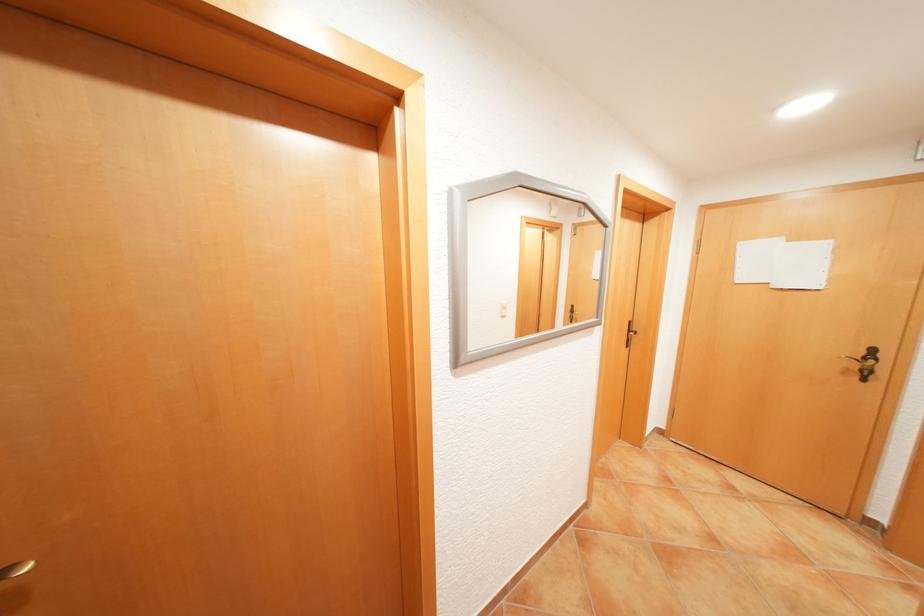
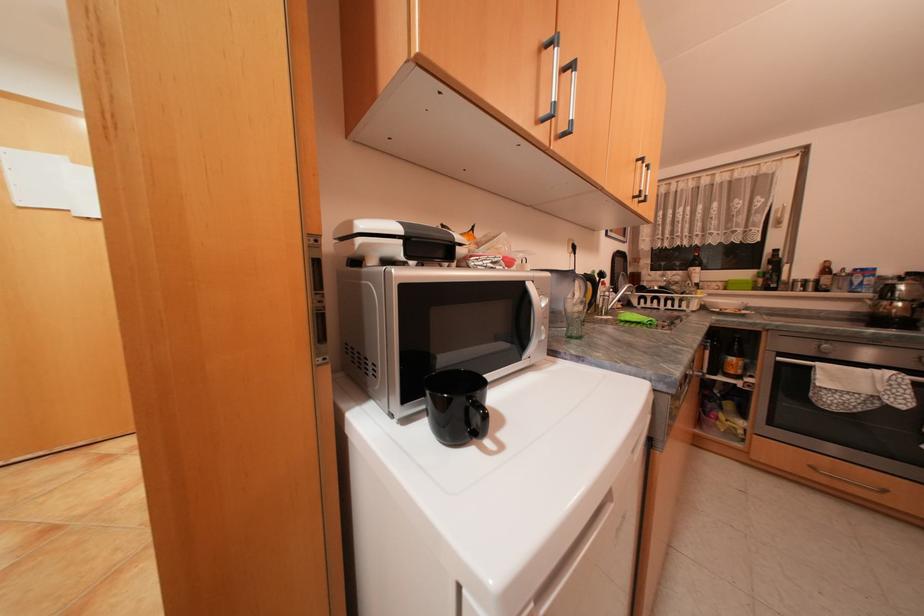
Question: The camera is either moving clockwise (left) or counter-clockwise (right) around the object. The first image is from the beginning of the video and the second image is from the end. Is the camera moving left or right when shooting the video?

Choices:
 (A) Left
 (B) Right

Answer: (A)